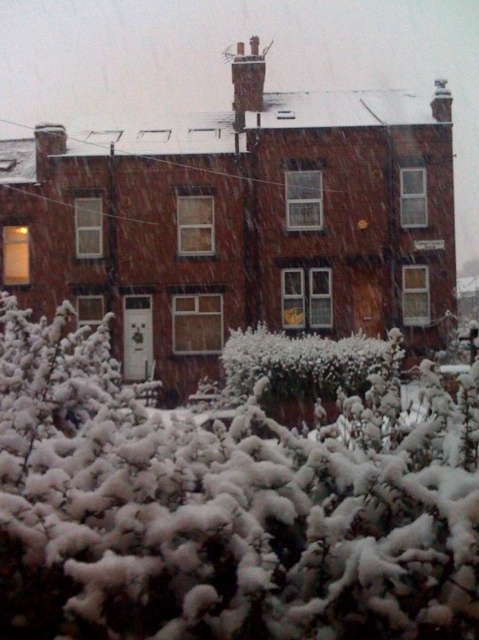
You are a snowplow operator trying to clear the driveway in front of the white fluffy bush at lower center and the white fluffy bush at center. Considering their sizes, which bush will require more time to clear around?

The white fluffy bush at lower center will require more time to clear around since it has a larger size compared to the white fluffy bush at center.